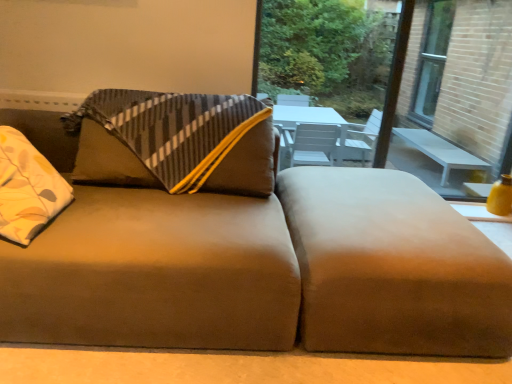
Question: Is transparent glass window at upper right in front of or behind suede brown couch at center in the image?

Choices:
 (A) front
 (B) behind

Answer: (B)

Question: Is transparent glass window at upper right spatially inside suede brown couch at center, or outside of it?

Choices:
 (A) inside
 (B) outside

Answer: (B)

Question: Estimate the real-world distances between objects in this image. Which object is farther from the transparent glass window at upper right?

Choices:
 (A) suede brown couch at center
 (B) suede-like brown footrest at lower right

Answer: (B)

Question: Estimate the real-world distances between objects in this image. Which object is farther from the transparent glass window at upper right?

Choices:
 (A) suede brown couch at center
 (B) suede-like brown footrest at lower right

Answer: (B)